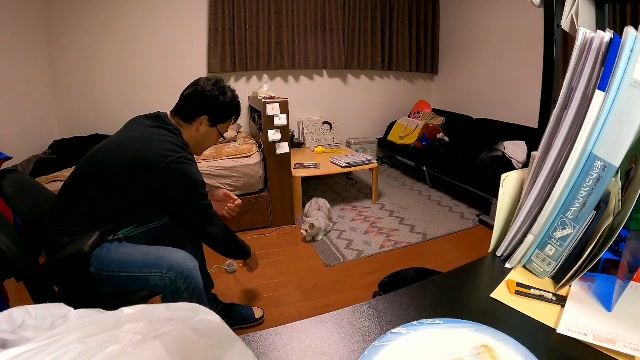
Locate an element on the screen. black table surface is located at coordinates (452, 291).